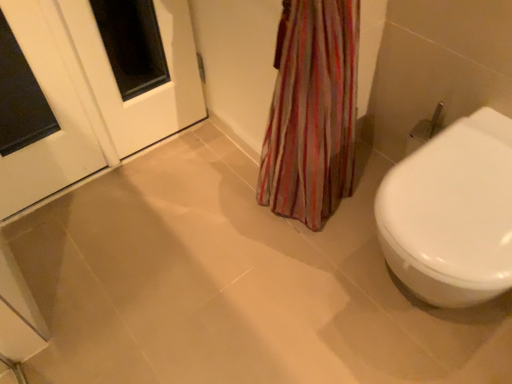
I want to click on vacant space to the right of white glossy door at upper left, so click(x=120, y=207).